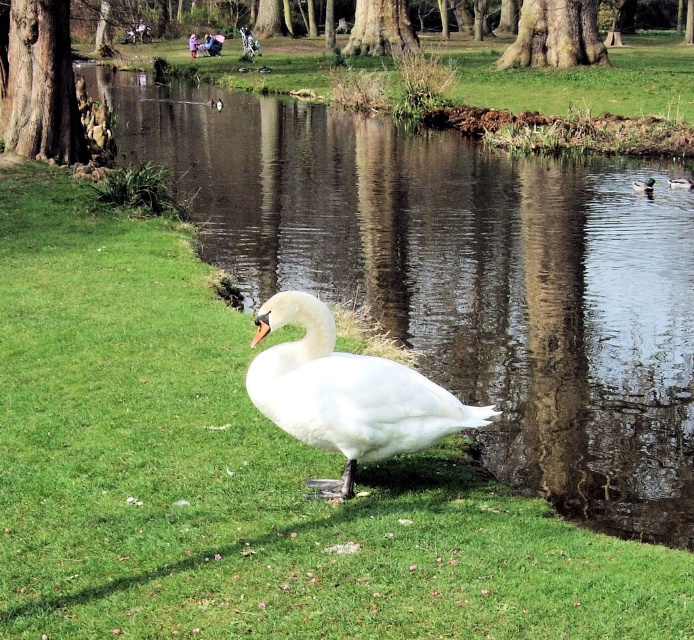
Who is lower down, white feathered swan at center or brown fuzzy duck at center?

white feathered swan at center is below.

Between white feathered swan at center and brown fuzzy duck at center, which one appears on the left side from the viewer's perspective?

Positioned to the left is white feathered swan at center.

At what (x,y) coordinates should I click in order to perform the action: click on white feathered swan at center. Please return your answer as a coordinate pair (x, y). Looking at the image, I should click on (347, 394).

Can you confirm if green glossy duck at right is wider than brown fuzzy duck at center?

In fact, green glossy duck at right might be narrower than brown fuzzy duck at center.

Does green glossy duck at right have a lesser width compared to brown fuzzy duck at center?

Indeed, green glossy duck at right has a lesser width compared to brown fuzzy duck at center.

At what (x,y) coordinates should I click in order to perform the action: click on green glossy duck at right. Please return your answer as a coordinate pair (x, y). This screenshot has width=694, height=640. Looking at the image, I should click on (643, 186).

From the picture: Between white feathered swan at center and green glossy duck at right, which one has more height?

Standing taller between the two is white feathered swan at center.

Identify the location of white feathered swan at center. (347, 394).

The width and height of the screenshot is (694, 640). In order to click on white feathered swan at center in this screenshot , I will do `click(347, 394)`.